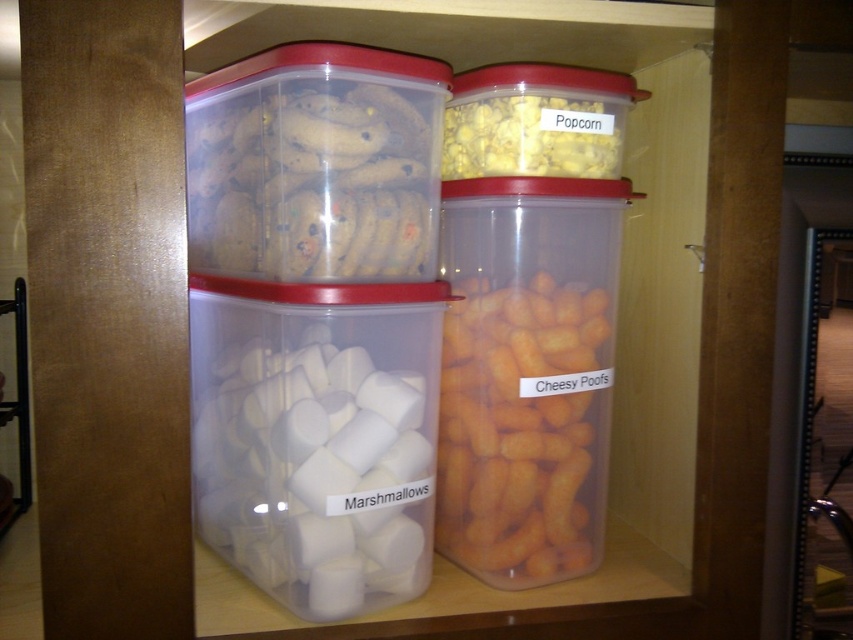
Which is above, translucent yellowish-orange snack at center-right or translucent plastic cookies at upper left?

translucent plastic cookies at upper left

Where is `translucent yellowish-orange snack at center-right`? This screenshot has height=640, width=853. translucent yellowish-orange snack at center-right is located at coordinates (523, 428).

Is translucent yellowish-orange snack at center-right to the right of yellow popcorn at center from the viewer's perspective?

In fact, translucent yellowish-orange snack at center-right is to the left of yellow popcorn at center.

Who is lower down, translucent yellowish-orange snack at center-right or yellow popcorn at center?

translucent yellowish-orange snack at center-right is below.

What do you see at coordinates (523, 428) in the screenshot?
I see `translucent yellowish-orange snack at center-right` at bounding box center [523, 428].

At what (x,y) coordinates should I click in order to perform the action: click on translucent yellowish-orange snack at center-right. Please return your answer as a coordinate pair (x, y). This screenshot has width=853, height=640. Looking at the image, I should click on (523, 428).

What do you see at coordinates (315, 180) in the screenshot? I see `translucent plastic cookies at upper left` at bounding box center [315, 180].

The width and height of the screenshot is (853, 640). I want to click on translucent plastic cookies at upper left, so (x=315, y=180).